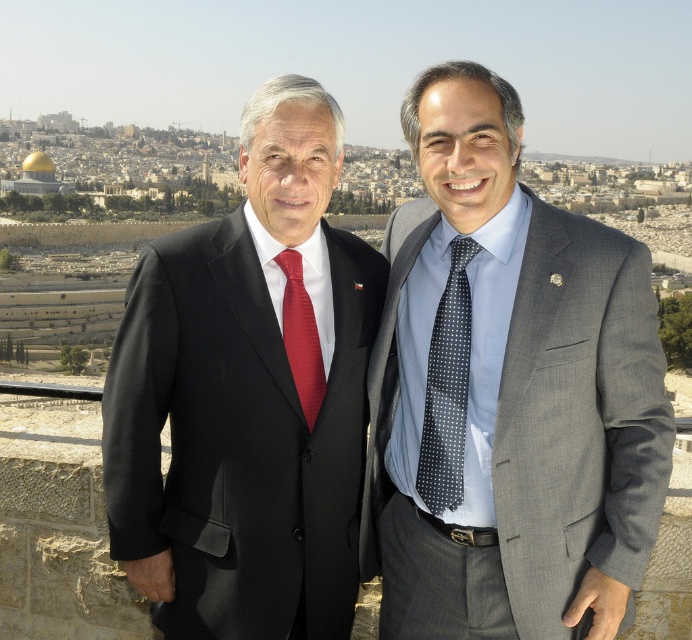
You are a photographer trying to capture a closeup shot of the dark blue dotted tie at center and the matte red tie at center. Which tie will appear larger in your photo?

The dark blue dotted tie at center will appear larger in the photo because it is closer to the viewer than the matte red tie at center.

You are a photographer standing at the camera position. You need to adjust your lens to focus on the black matte suit at center. What is the approximate distance you should set your lens to?

The black matte suit at center is 38.24 meters from camera, so you should set your lens to approximately 38.24 meters to focus properly.

You are a photographer adjusting the camera settings to ensure both the black matte suit at center and the gray textured suit at right are clearly visible. Considering their sizes, which suit might require more focus adjustments due to its smaller size?

The black matte suit at center has a lesser width compared to the gray textured suit at right, so it might require more focus adjustments due to its smaller size.